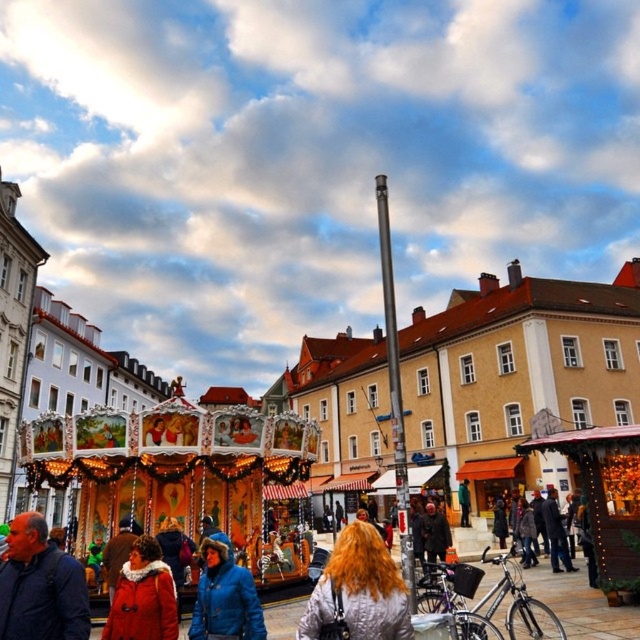
Question: Among these objects, which one is farthest from the camera?

Choices:
 (A) silky red hair at center
 (B) matte red coat at lower left
 (C) dark blue jacket at lower left
 (D) blue down jacket at center

Answer: (D)

Question: Which object appears closest to the camera in this image?

Choices:
 (A) silky red hair at center
 (B) blue down jacket at center

Answer: (A)

Question: Can you confirm if silky red hair at center is positioned below matte red coat at lower left?

Choices:
 (A) yes
 (B) no

Answer: (A)

Question: Which of the following is the farthest from the observer?

Choices:
 (A) (193, 611)
 (B) (385, 621)
 (C) (52, 564)

Answer: (A)

Question: Is dark blue jacket at lower left further to camera compared to blue down jacket at center?

Choices:
 (A) no
 (B) yes

Answer: (A)

Question: Is dark blue jacket at lower left bigger than silky red hair at center?

Choices:
 (A) no
 (B) yes

Answer: (A)